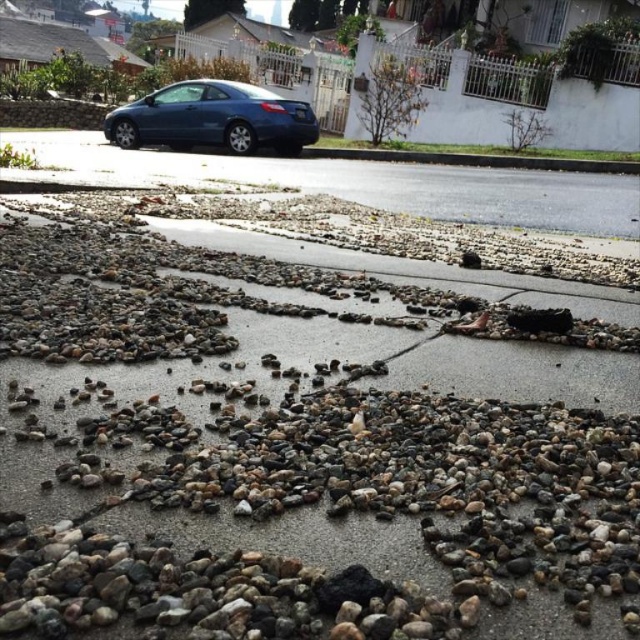
Which is in front, point (509, 381) or point (273, 93)?

Point (509, 381) is in front.

Does multicolored pebbles at center have a smaller size compared to matte blue car at center?

Correct, multicolored pebbles at center occupies less space than matte blue car at center.

The width and height of the screenshot is (640, 640). What are the coordinates of `multicolored pebbles at center` in the screenshot? It's located at (291, 452).

The width and height of the screenshot is (640, 640). Find the location of `multicolored pebbles at center`. multicolored pebbles at center is located at coordinates (291, 452).